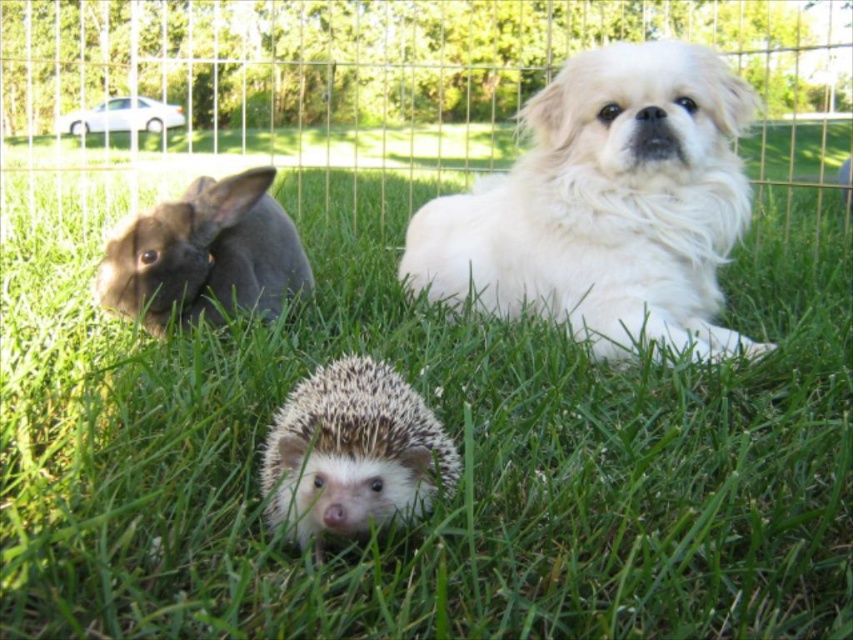
Question: Which point is farther from the camera taking this photo?

Choices:
 (A) (228, 193)
 (B) (102, 138)
 (C) (486, 230)

Answer: (B)

Question: Which of the following is the farthest from the observer?

Choices:
 (A) white fluffy dog at center
 (B) metallic wire fence at upper center
 (C) dark gray fur rabbit at left
 (D) white spiny hedgehog at center

Answer: (B)

Question: Can you confirm if white fluffy dog at center is positioned to the right of dark gray fur rabbit at left?

Choices:
 (A) yes
 (B) no

Answer: (A)

Question: Can you confirm if metallic wire fence at upper center is positioned above dark gray fur rabbit at left?

Choices:
 (A) yes
 (B) no

Answer: (A)

Question: Is metallic wire fence at upper center positioned behind white fluffy dog at center?

Choices:
 (A) yes
 (B) no

Answer: (A)

Question: Which object is the closest to the dark gray fur rabbit at left?

Choices:
 (A) metallic wire fence at upper center
 (B) white fluffy dog at center

Answer: (B)